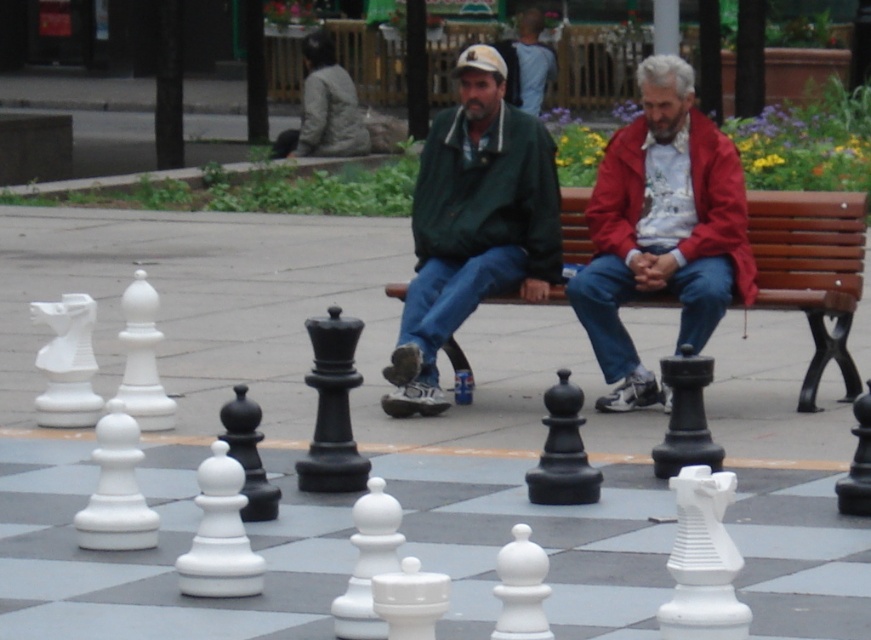
Is red matte jacket at center smaller than beech wood bench at center?

Actually, red matte jacket at center might be larger than beech wood bench at center.

Between point (665, 248) and point (815, 221), which one is positioned behind?

The point (815, 221) is behind.

Where is `red matte jacket at center`? red matte jacket at center is located at coordinates (660, 228).

At what (x,y) coordinates should I click in order to perform the action: click on green matte jacket at center. Please return your answer as a coordinate pair (x, y). The width and height of the screenshot is (871, 640). Looking at the image, I should click on (473, 224).

From the picture: Which of these two, green matte jacket at center or beech wood bench at center, stands taller?

green matte jacket at center is taller.

Identify the location of green matte jacket at center. (473, 224).

Does red matte jacket at center have a lesser height compared to green matte jacket at center?

Result: Correct, red matte jacket at center is not as tall as green matte jacket at center.

Can you confirm if red matte jacket at center is smaller than green matte jacket at center?

Correct, red matte jacket at center occupies less space than green matte jacket at center.

At what (x,y) coordinates should I click in order to perform the action: click on red matte jacket at center. Please return your answer as a coordinate pair (x, y). Image resolution: width=871 pixels, height=640 pixels. Looking at the image, I should click on (660, 228).

Image resolution: width=871 pixels, height=640 pixels. What are the coordinates of `red matte jacket at center` in the screenshot? It's located at (660, 228).